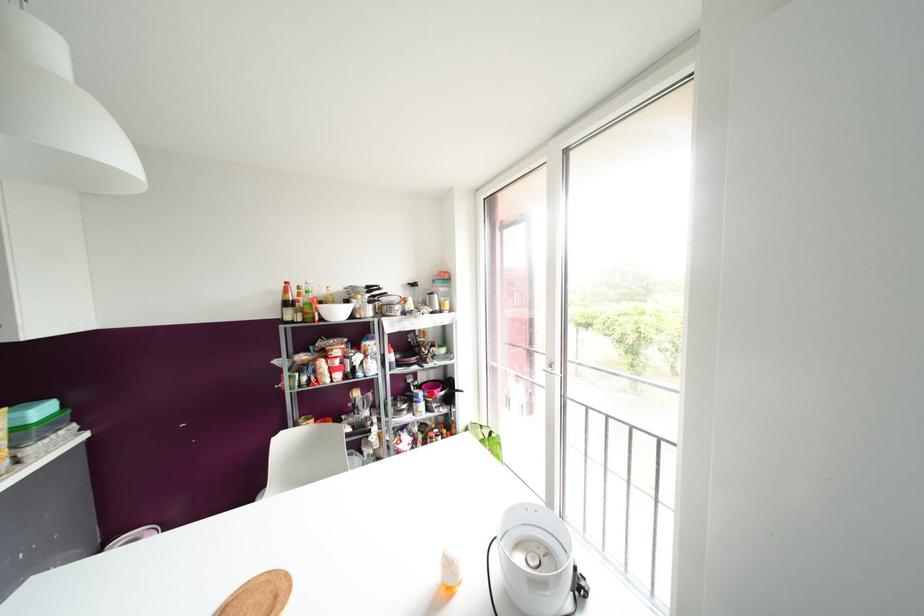
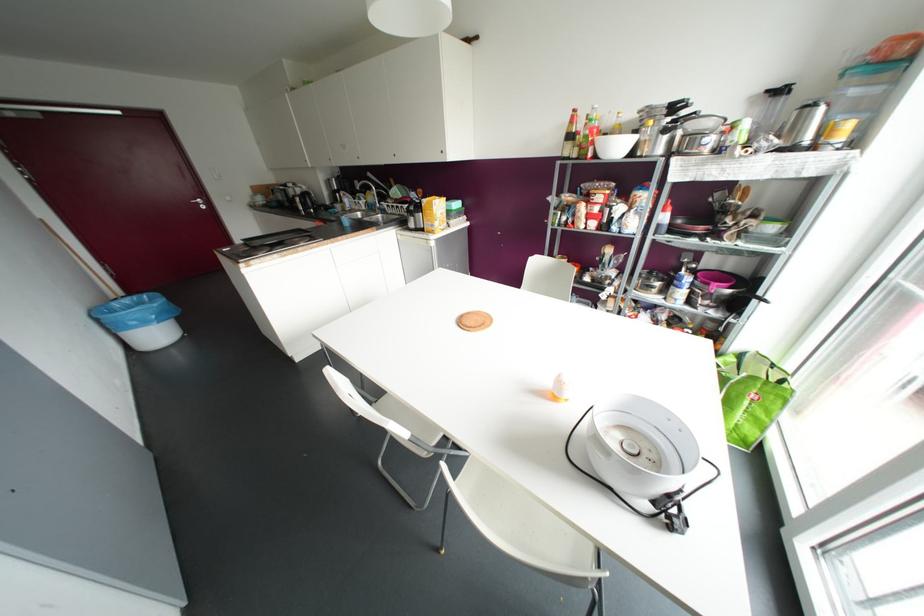
Question: A red point is marked in image1. In image2, is the corresponding 3D point closer to the camera or farther? Reply with the corresponding letter.

Choices:
 (A) The corresponding 3D point is closer.
 (B) The corresponding 3D point is farther.

Answer: (A)